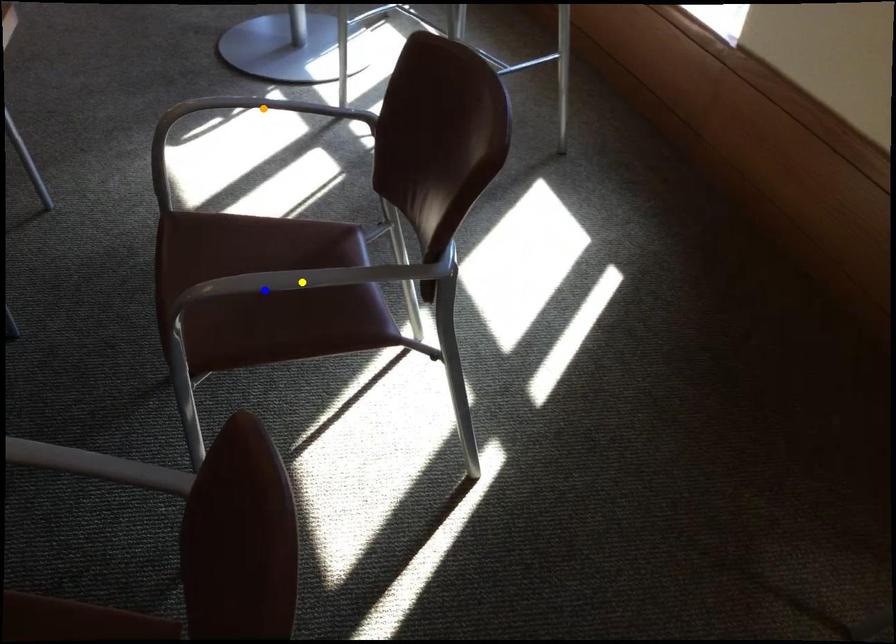
Order these from farthest to nearest:
- blue point
- yellow point
- orange point

orange point, blue point, yellow point